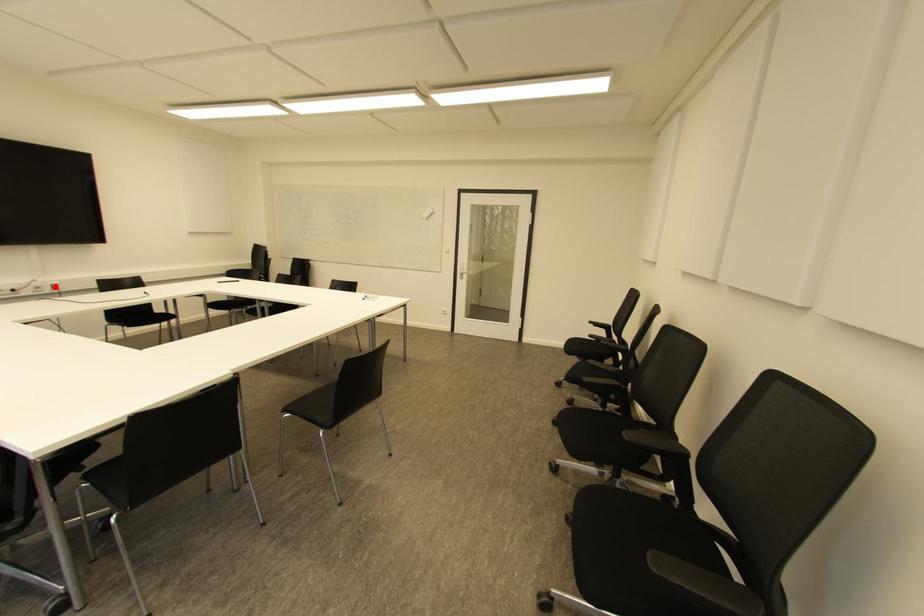
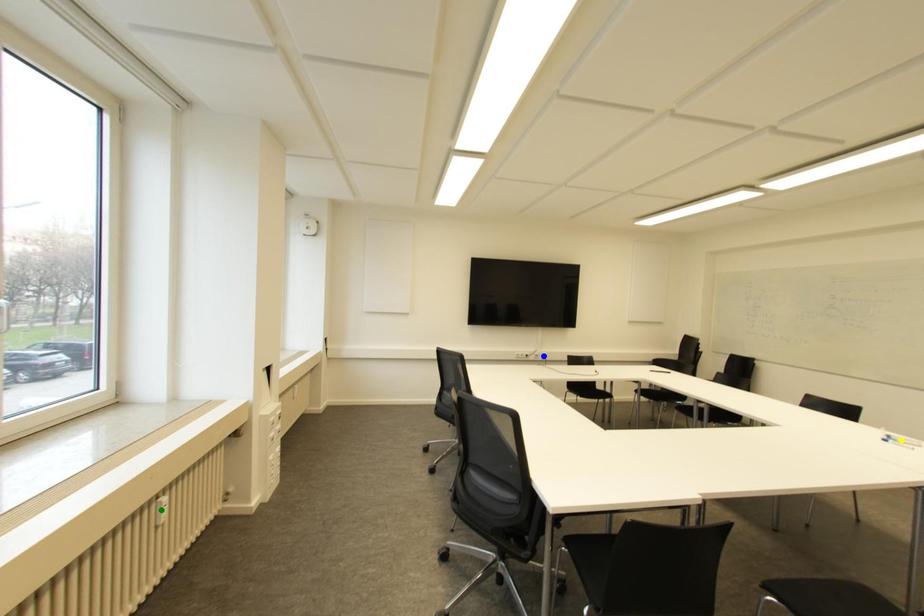
Question: I am providing you with two images of the same scene from different viewpoints. A red point is marked on the first image. You are given multiple points on the second image. In image 2, which mark is for the same physical point as the one in image 1?

Choices:
 (A) yellow point
 (B) green point
 (C) blue point

Answer: (C)